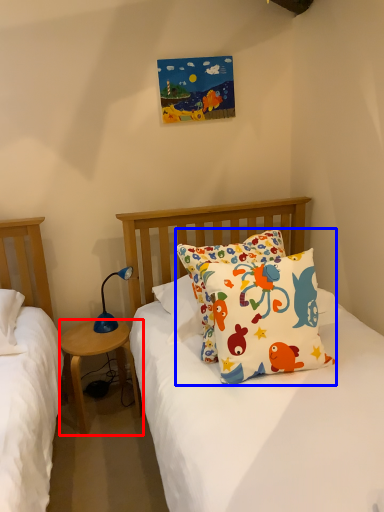
Question: Among these objects, which one is farthest to the camera, nightstand (highlighted by a red box) or pillow (highlighted by a blue box)?

Choices:
 (A) nightstand
 (B) pillow

Answer: (A)